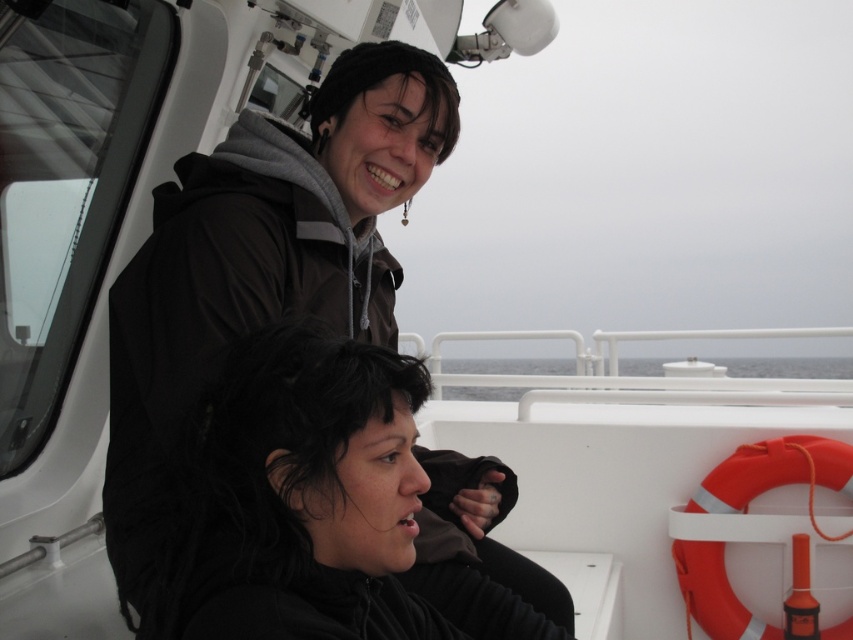
Describe the element at coordinates (328, 509) in the screenshot. I see `black matte hair at center` at that location.

Between black matte hair at center and gray water at center, which one appears on the left side from the viewer's perspective?

Positioned to the left is black matte hair at center.

Does point (422, 560) lie in front of point (585, 385)?

That is True.

Identify the location of black matte hair at center. This screenshot has width=853, height=640. (328, 509).

Does black matte hair at center appear on the right side of orange rubber life jacket at right?

No, black matte hair at center is not to the right of orange rubber life jacket at right.

What do you see at coordinates (328, 509) in the screenshot?
I see `black matte hair at center` at bounding box center [328, 509].

Find the location of a particular element. Image resolution: width=853 pixels, height=640 pixels. black matte hair at center is located at coordinates (328, 509).

Can you confirm if orange rubber life jacket at right is positioned to the right of gray water at center?

Yes, orange rubber life jacket at right is to the right of gray water at center.

Is orange rubber life jacket at right in front of gray water at center?

Yes, it is.

Who is more forward, (708, 512) or (490, 371)?

Point (708, 512) is in front.

This screenshot has width=853, height=640. In order to click on orange rubber life jacket at right in this screenshot , I will do `click(775, 474)`.